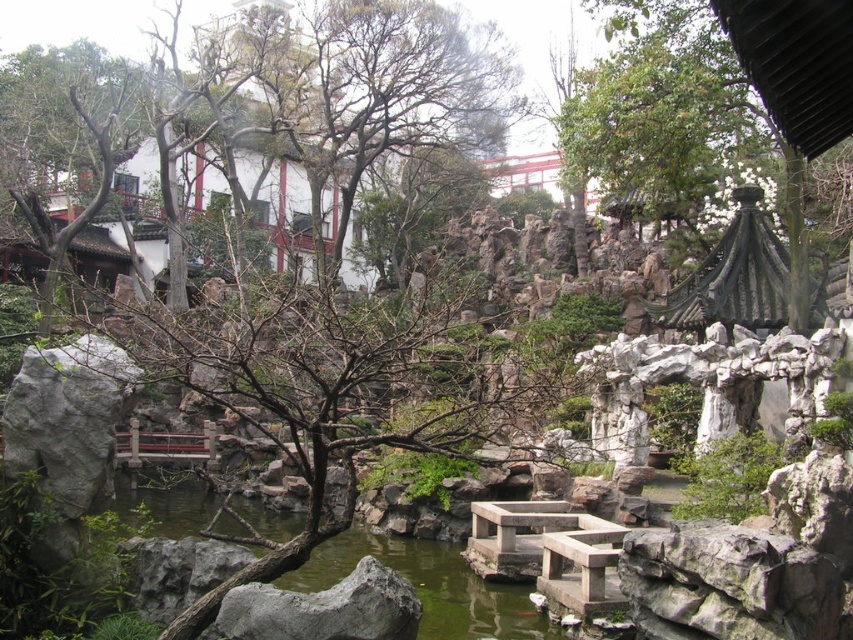
Consider the image. Is green leafy tree at upper center bigger than green stone water at center?

Yes.

Can you confirm if green leafy tree at upper center is positioned to the right of green stone water at center?

Indeed, green leafy tree at upper center is positioned on the right side of green stone water at center.

Find the location of `green leafy tree at upper center`. green leafy tree at upper center is located at coordinates (656, 125).